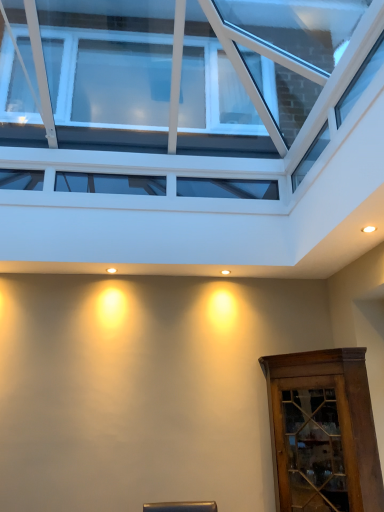
Question: From a real-world perspective, is brown wooden cabinet at lower right under transparent glass window at upper center?

Choices:
 (A) yes
 (B) no

Answer: (A)

Question: Are brown wooden cabinet at lower right and transparent glass window at upper center far apart?

Choices:
 (A) yes
 (B) no

Answer: (A)

Question: Is brown wooden cabinet at lower right positioned with its back to transparent glass window at upper center?

Choices:
 (A) yes
 (B) no

Answer: (B)

Question: Is brown wooden cabinet at lower right shorter than transparent glass window at upper center?

Choices:
 (A) no
 (B) yes

Answer: (B)

Question: From the image's perspective, is brown wooden cabinet at lower right above transparent glass window at upper center?

Choices:
 (A) no
 (B) yes

Answer: (A)

Question: Does brown wooden cabinet at lower right come behind transparent glass window at upper center?

Choices:
 (A) yes
 (B) no

Answer: (A)

Question: Is brown wooden cabinet at lower right surrounded by transparent glass window at upper center?

Choices:
 (A) yes
 (B) no

Answer: (B)

Question: Can you confirm if transparent glass window at upper center is positioned to the left of brown wooden cabinet at lower right?

Choices:
 (A) no
 (B) yes

Answer: (B)

Question: From the image's perspective, is transparent glass window at upper center on brown wooden cabinet at lower right?

Choices:
 (A) yes
 (B) no

Answer: (A)

Question: Considering the relative sizes of transparent glass window at upper center and brown wooden cabinet at lower right in the image provided, is transparent glass window at upper center taller than brown wooden cabinet at lower right?

Choices:
 (A) no
 (B) yes

Answer: (B)

Question: From the image's perspective, does transparent glass window at upper center appear lower than brown wooden cabinet at lower right?

Choices:
 (A) yes
 (B) no

Answer: (B)

Question: Is transparent glass window at upper center touching brown wooden cabinet at lower right?

Choices:
 (A) yes
 (B) no

Answer: (B)

Question: From the image's perspective, is transparent glass window at upper center above or below brown wooden cabinet at lower right?

Choices:
 (A) above
 (B) below

Answer: (A)